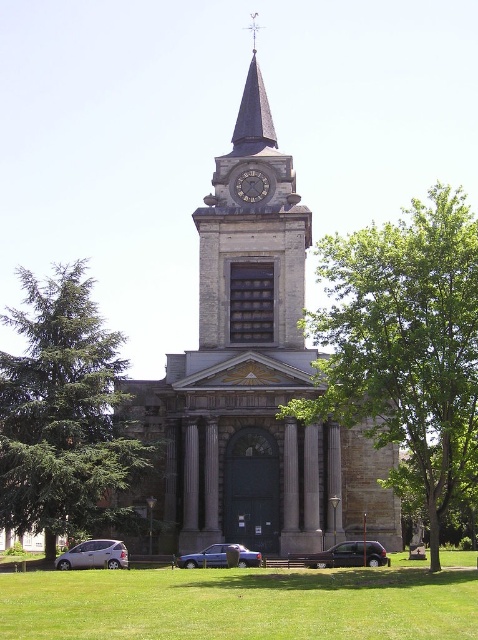
Consider the image. Measure the distance between stone clock tower at center and dark gray stone clock at center.

stone clock tower at center is 29.02 feet from dark gray stone clock at center.

Is stone clock tower at center to the right of dark gray stone clock at center from the viewer's perspective?

Correct, you'll find stone clock tower at center to the right of dark gray stone clock at center.

Who is more distant from viewer, (252,122) or (242,182)?

The point (252,122) is more distant.

Locate an element on the screen. The image size is (478, 640). stone clock tower at center is located at coordinates (251, 230).

Describe the element at coordinates (253, 381) in the screenshot. I see `stone church at center` at that location.

Does stone church at center appear under stone clock tower at center?

Yes.

Based on the photo, who is more distant from viewer, (201, 342) or (201, 243)?

Point (201, 243)

This screenshot has width=478, height=640. In order to click on stone church at center in this screenshot , I will do `click(253, 381)`.

In the scene shown: Is stone clock tower at center above metallic silver van at center?

Yes.

Is point (270, 266) positioned behind point (361, 547)?

Yes, it is behind point (361, 547).

Where is `stone clock tower at center`? The image size is (478, 640). stone clock tower at center is located at coordinates (251, 230).